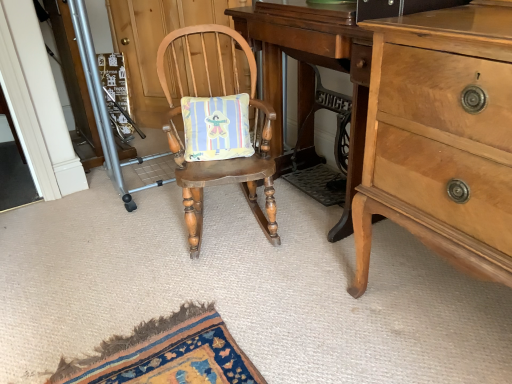
Question: In the image, is metallic silver screen door at left on the left side or the right side of light brown wood dresser at right?

Choices:
 (A) right
 (B) left

Answer: (B)

Question: Considering the positions of metallic silver screen door at left and light brown wood dresser at right in the image, is metallic silver screen door at left taller or shorter than light brown wood dresser at right?

Choices:
 (A) tall
 (B) short

Answer: (A)

Question: Based on their relative distances, which object is farther from the wooden rocking chair at center?

Choices:
 (A) light brown wood dresser at right
 (B) light brown wood changing table at center
 (C) metallic silver screen door at left

Answer: (C)

Question: Estimate the real-world distances between objects in this image. Which object is closer to the wooden rocking chair at center?

Choices:
 (A) metallic silver screen door at left
 (B) light brown wood changing table at center
 (C) light brown wood dresser at right

Answer: (B)